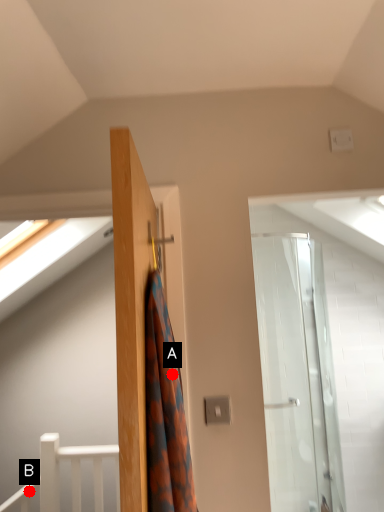
Question: Two points are circled on the image, labeled by A and B beside each circle. Which point appears closest to the camera in this image?

Choices:
 (A) A is closer
 (B) B is closer

Answer: (A)